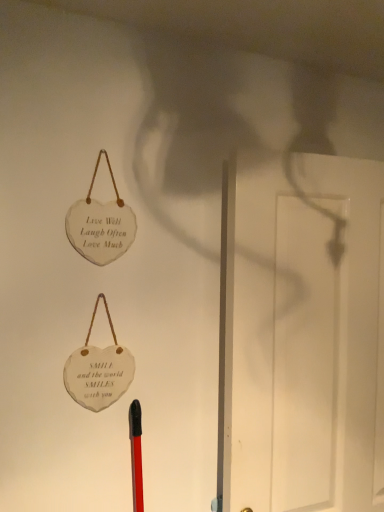
Question: Should I look upward or downward to see white wood screen door at right?

Choices:
 (A) up
 (B) down

Answer: (B)